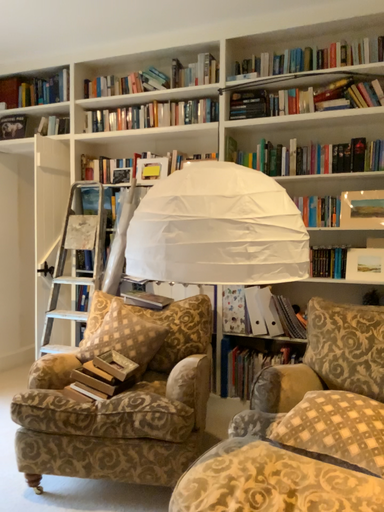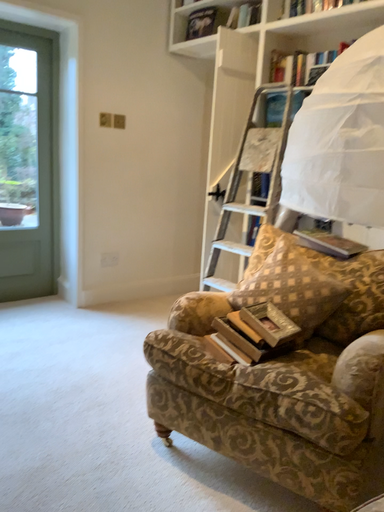
Question: Which way did the camera rotate in the video?

Choices:
 (A) rotated downward
 (B) rotated upward

Answer: (A)